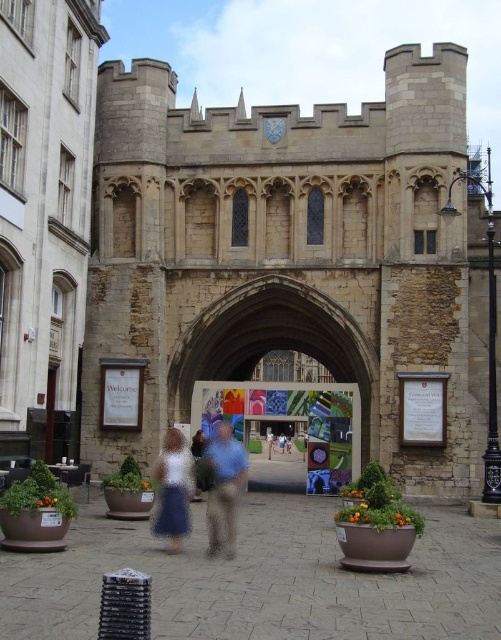
Question: Is stone archway at center below light blue denim jeans at center?

Choices:
 (A) no
 (B) yes

Answer: (A)

Question: Which of the following is the farthest from the observer?

Choices:
 (A) blue denim jeans at center
 (B) blue denim shorts at center
 (C) light blue denim jeans at center

Answer: (B)

Question: Is blue denim skirt at center thinner than blue denim shorts at center?

Choices:
 (A) yes
 (B) no

Answer: (B)

Question: Which object appears farthest from the camera in this image?

Choices:
 (A) blue denim jeans at center
 (B) stone archway at center
 (C) light blue denim jeans at center
 (D) blue cotton shirt at center

Answer: (C)

Question: Estimate the real-world distances between objects in this image. Which object is closer to the blue denim skirt at center?

Choices:
 (A) blue denim shorts at center
 (B) stone archway at center
 (C) light blue denim jeans at center
 (D) blue denim jeans at center

Answer: (D)

Question: Is stone archway at center smaller than blue denim shorts at center?

Choices:
 (A) no
 (B) yes

Answer: (A)